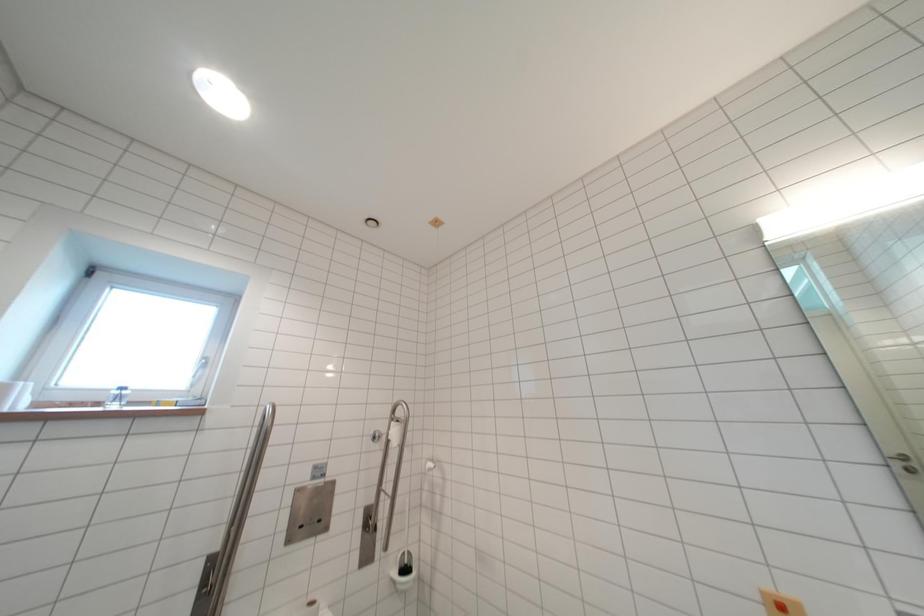
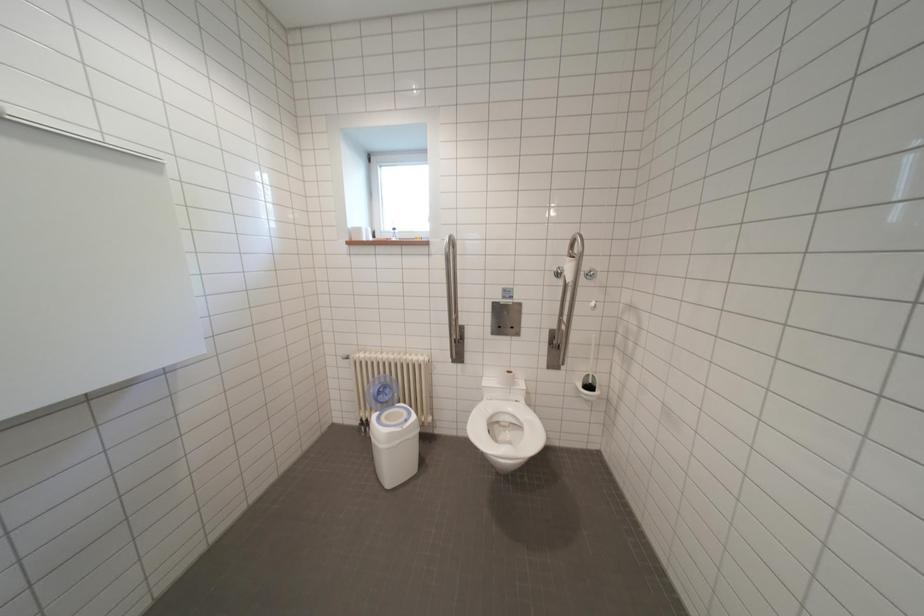
The images are taken continuously from a first-person perspective. In which direction is your viewpoint rotating?

The camera's rotation is toward left-down.